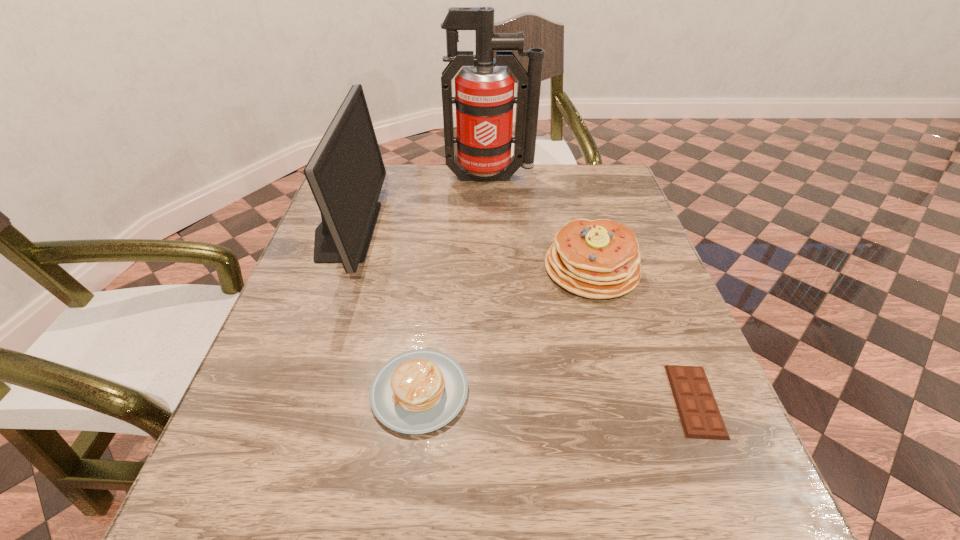
You are a GUI agent. You are given a task and a screenshot of the screen. Output one action in this format:
    pyautogui.click(x=<x>, y=<y>)
    Task: Click on the free location that satisfies the following two spatial constraints: 1. on the front label side of the fire extinguisher; 2. on the screen side of the second tallest object
    
    Given the screenshot: What is the action you would take?
    492,231

Where is `free spot that satisfies the following two spatial constraints: 1. on the front label side of the chocolate bar; 2. on the left side of the tallest object`? The height and width of the screenshot is (540, 960). free spot that satisfies the following two spatial constraints: 1. on the front label side of the chocolate bar; 2. on the left side of the tallest object is located at coordinates (498, 401).

At what (x,y) coordinates should I click in order to perform the action: click on free spot that satisfies the following two spatial constraints: 1. on the front side of the taller pancake; 2. on the left side of the shortest object. Please return your answer as a coordinate pair (x, y). Image resolution: width=960 pixels, height=540 pixels. Looking at the image, I should click on pos(628,401).

In order to click on free location that satisfies the following two spatial constraints: 1. on the front side of the right pancake; 2. on the right side of the shortest object in this screenshot , I will do `click(628, 401)`.

This screenshot has width=960, height=540. I want to click on free location that satisfies the following two spatial constraints: 1. on the screen side of the computer monitor; 2. on the back side of the left pancake, so click(287, 391).